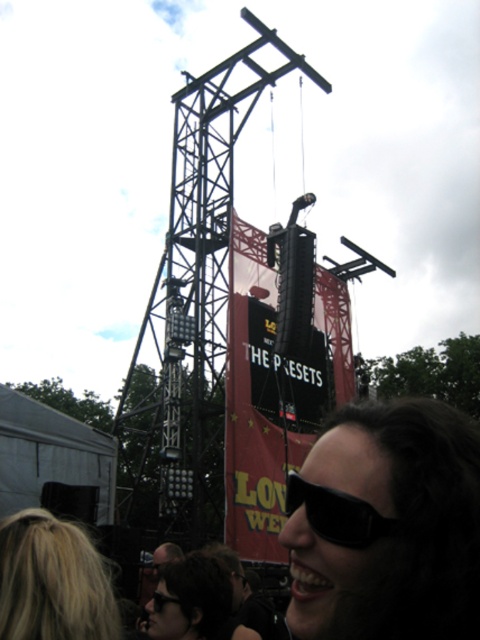
Is blonde hair at lower left shorter than black matte scoreboard at center?

Correct, blonde hair at lower left is not as tall as black matte scoreboard at center.

This screenshot has height=640, width=480. What do you see at coordinates (52, 580) in the screenshot?
I see `blonde hair at lower left` at bounding box center [52, 580].

Locate an element on the screen. The height and width of the screenshot is (640, 480). blonde hair at lower left is located at coordinates (52, 580).

Which is above, black matte sunglasses at lower center or black plastic goggles at lower center?

black matte sunglasses at lower center is above.

Is black matte sunglasses at lower center shorter than black plastic goggles at lower center?

No, black matte sunglasses at lower center is not shorter than black plastic goggles at lower center.

Between point (323, 529) and point (160, 595), which one is positioned in front?

Point (323, 529) is in front.

At what (x,y) coordinates should I click in order to perform the action: click on black matte sunglasses at lower center. Please return your answer as a coordinate pair (x, y). This screenshot has height=640, width=480. Looking at the image, I should click on (337, 513).

Can you confirm if black matte scoreboard at center is positioned above matte black sunglasses at lower center?

Yes.

Which is more to the right, black matte scoreboard at center or matte black sunglasses at lower center?

black matte scoreboard at center is more to the right.

Which is behind, point (290, 387) or point (196, 561)?

The point (290, 387) is more distant.

Find the location of `black matte scoreboard at center`. black matte scoreboard at center is located at coordinates (287, 372).